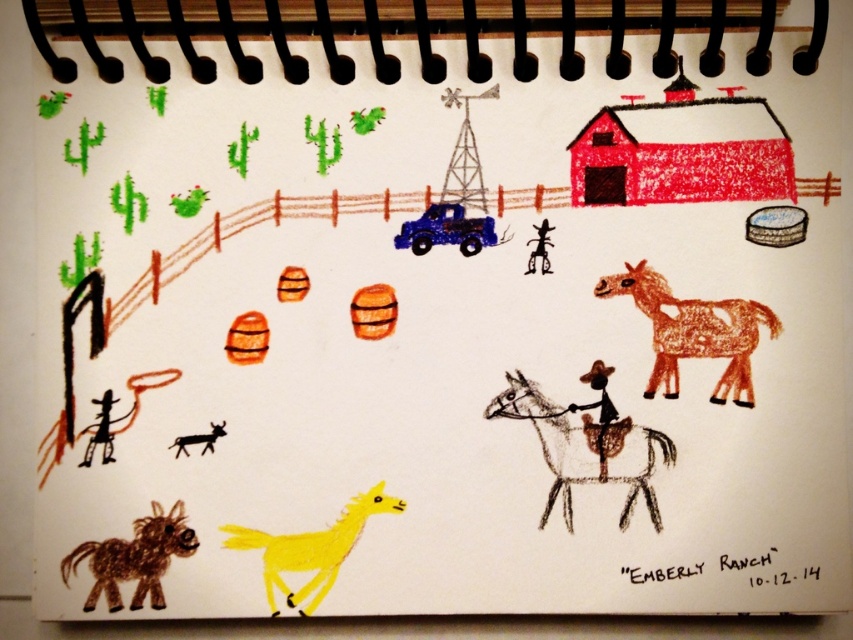
Question: Is brown textured horse at center thinner than yellow matte horse at lower left?

Choices:
 (A) no
 (B) yes

Answer: (A)

Question: Which of the following is the closest to the observer?

Choices:
 (A) (672, 324)
 (B) (515, 403)
 (C) (300, 552)

Answer: (C)

Question: Which object is the closest to the brown textured horse at center?

Choices:
 (A) yellow matte horse at lower left
 (B) brown textured horse at lower right

Answer: (B)

Question: Which point is farther from the camera taking this photo?

Choices:
 (A) (132, 547)
 (B) (730, 364)
 (C) (654, 509)
 (D) (332, 544)

Answer: (B)

Question: Can you confirm if brown textured horse at center is positioned below yellow matte horse at lower left?

Choices:
 (A) yes
 (B) no

Answer: (B)

Question: Does yellow matte horse at lower left have a greater width compared to brown scribbled horse at lower left?

Choices:
 (A) no
 (B) yes

Answer: (B)